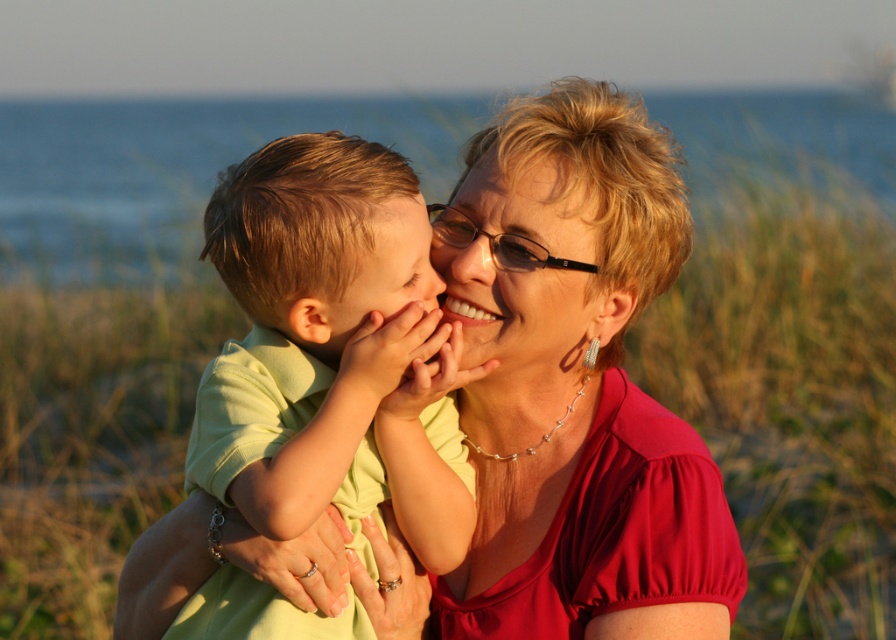
You are a photographer trying to capture the scene with the matte red blouse at center and the blue water at upper center. Based on their sizes in the image, which object would appear smaller in the final photo?

The matte red blouse at center appears smaller in the photo because it is not as tall as the blue water at upper center.

You are a photographer trying to capture the scene. You need to ensure that the light green cotton shirt at center and the smooth blonde hair at upper center are both visible in the frame. Which object should you prioritize keeping in focus if you can only focus on one due to limited depth of field?

The light green cotton shirt at center should be prioritized because its width is larger than the smooth blonde hair at upper center, making it more prominent in the frame.

You are a photographer trying to capture the interaction between the two subjects in the image. Which object, the light green cotton shirt at center or the smooth skin face at center, is closer to the camera?

The light green cotton shirt at center is closer to the camera than the smooth skin face at center because it is in front of it.